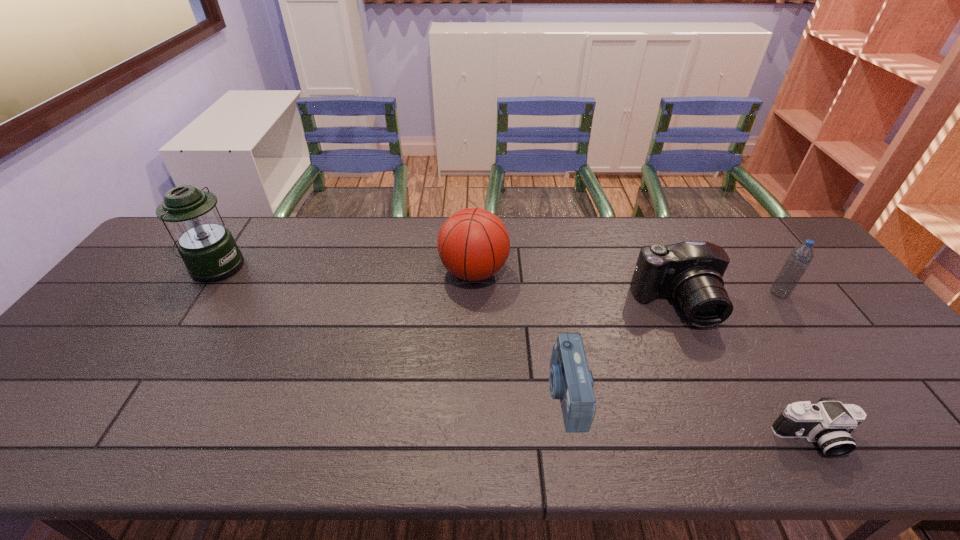
Identify the location of the tallest object. Image resolution: width=960 pixels, height=540 pixels. (208, 249).

The height and width of the screenshot is (540, 960). In order to click on the leftmost object in this screenshot , I will do `click(208, 249)`.

Locate an element on the screen. This screenshot has height=540, width=960. basketball is located at coordinates (473, 244).

Locate an element on the screen. water bottle is located at coordinates 801,256.

You are a GUI agent. You are given a task and a screenshot of the screen. Output one action in this format:
    pyautogui.click(x=<x>, y=<y>)
    Task: Click on the farthest camera
    This screenshot has width=960, height=540.
    Given the screenshot: What is the action you would take?
    pyautogui.click(x=690, y=272)

Locate an element on the screen. This screenshot has height=540, width=960. the fourth tallest object is located at coordinates (690, 272).

This screenshot has width=960, height=540. I want to click on the fourth object from right to left, so click(x=570, y=380).

The height and width of the screenshot is (540, 960). I want to click on vacant space located on the front of the leftmost object, so click(189, 306).

This screenshot has width=960, height=540. Find the location of `free spot located 0.060m on the back of the basketball`. free spot located 0.060m on the back of the basketball is located at coordinates (474, 240).

Where is `free point located on the front of the rightmost object`? This screenshot has height=540, width=960. free point located on the front of the rightmost object is located at coordinates (852, 394).